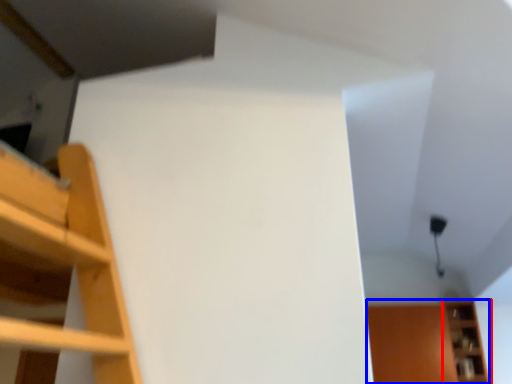
Question: Which of the following is the farthest to the observer, shelf (highlighted by a red box) or cabinet (highlighted by a blue box)?

Choices:
 (A) shelf
 (B) cabinet

Answer: (B)